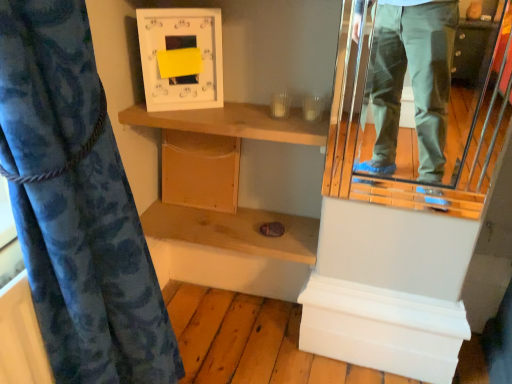
The width and height of the screenshot is (512, 384). I want to click on free space in front of wooden cabinet at center, so 205,226.